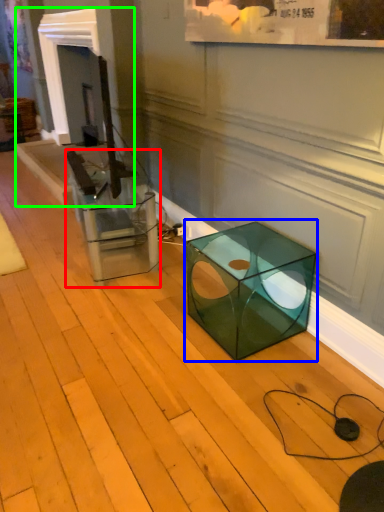
Question: Which is nearer to the glass box (highlighted by a red box)? table (highlighted by a blue box) or fireplace (highlighted by a green box).

Choices:
 (A) table
 (B) fireplace

Answer: (A)